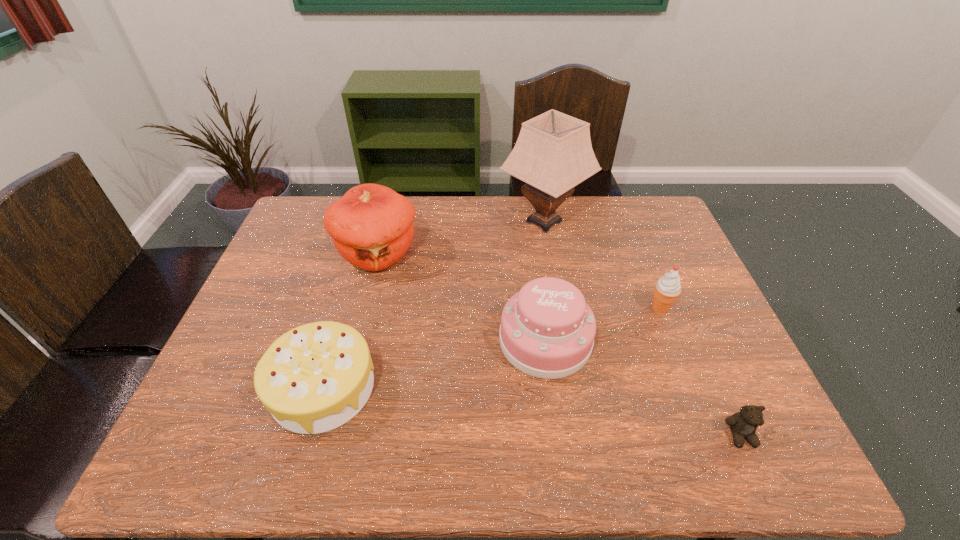
Image resolution: width=960 pixels, height=540 pixels. Find the location of `lampshade`. lampshade is located at coordinates (553, 153).

This screenshot has width=960, height=540. Find the location of `the second tallest object`. the second tallest object is located at coordinates (371, 226).

Image resolution: width=960 pixels, height=540 pixels. What are the coordinates of `the right birthday cake` in the screenshot? It's located at (547, 330).

Where is `icecream`? icecream is located at coordinates (667, 289).

Where is `the left birthday cake`? This screenshot has width=960, height=540. the left birthday cake is located at coordinates (314, 378).

At what (x,y) coordinates should I click in order to perform the action: click on the shortest object. Please return your answer as a coordinate pair (x, y). Looking at the image, I should click on (743, 424).

Find the location of `vacant space situated 0.130m on the left of the tallest object`. vacant space situated 0.130m on the left of the tallest object is located at coordinates coord(460,222).

Locate an element on the screen. free space located 0.070m on the back of the second tallest object is located at coordinates (388, 216).

Identify the location of vacant area situated 0.310m on the back of the right birthday cake. (532, 237).

The image size is (960, 540). I want to click on blank space located on the left of the icecream, so click(577, 308).